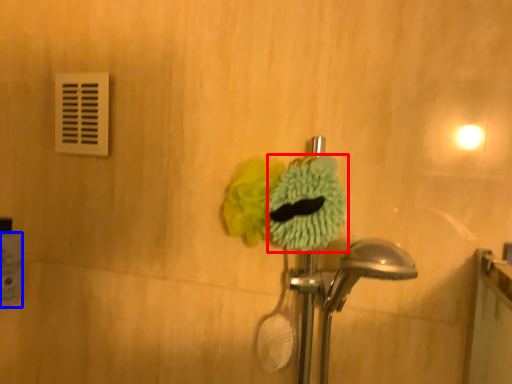
Question: Which object appears farthest to the camera in this image, flower (highlighted by a red box) or toilet paper (highlighted by a blue box)?

Choices:
 (A) flower
 (B) toilet paper

Answer: (B)